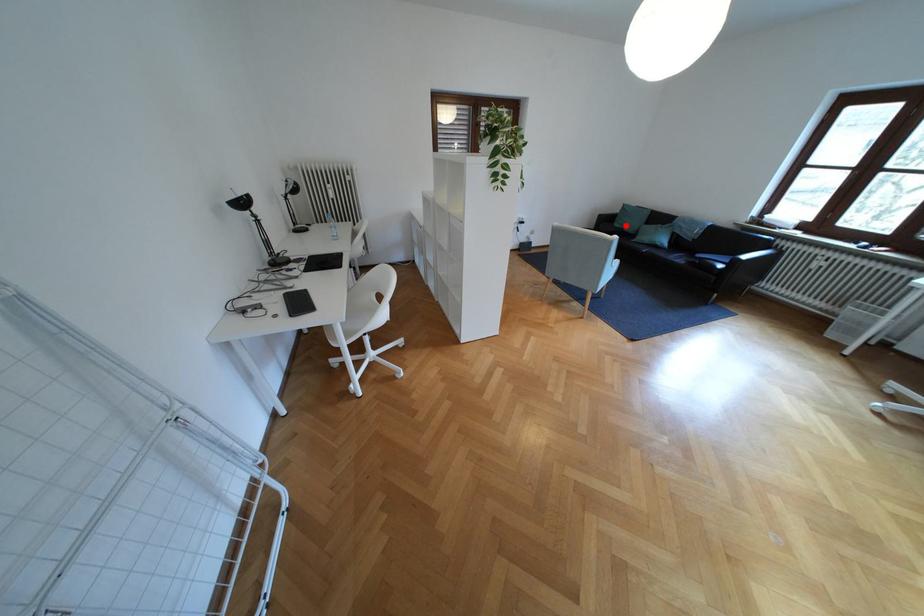
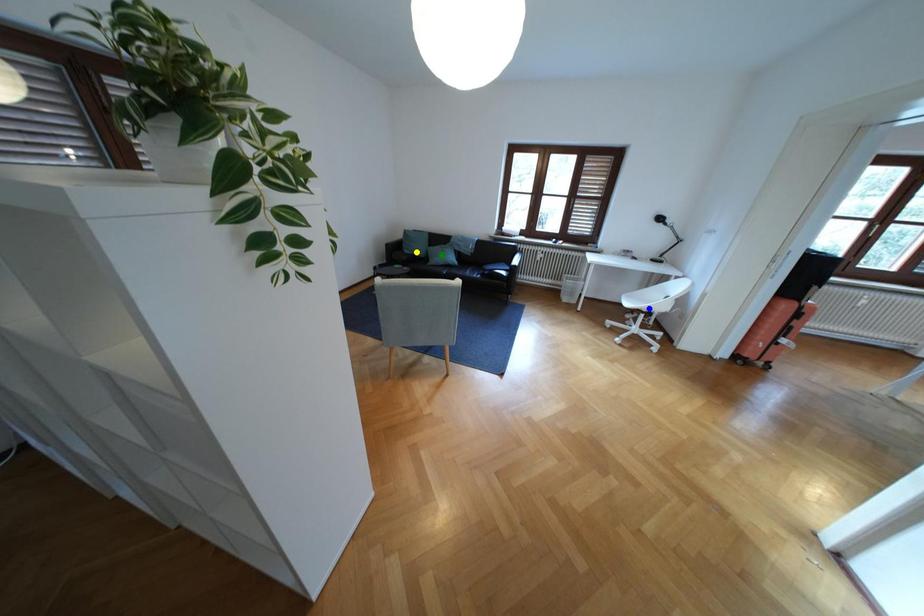
Question: I am providing you with two images of the same scene from different viewpoints. A red point is marked on the first image. You are given multiple points on the second image. Which point in image 2 represents the same 3d spot as the red point in image 1?

Choices:
 (A) green point
 (B) blue point
 (C) yellow point

Answer: (C)